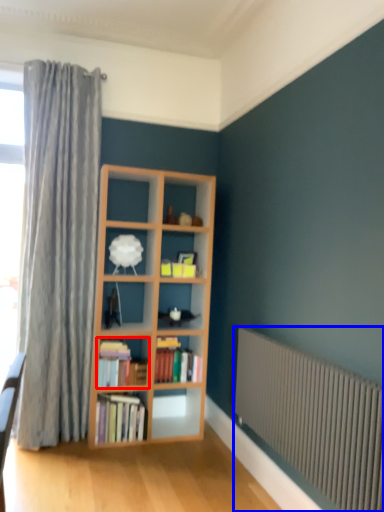
Question: Among these objects, which one is farthest to the camera, book (highlighted by a red box) or radiator (highlighted by a blue box)?

Choices:
 (A) book
 (B) radiator

Answer: (A)